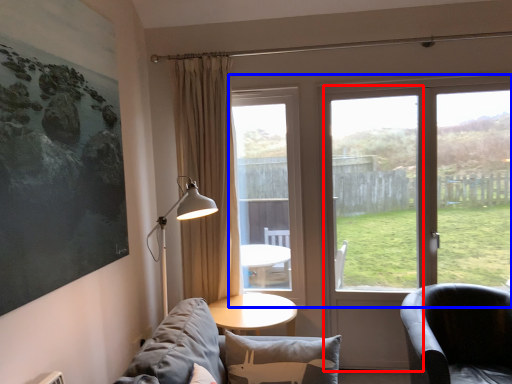
Question: Which object is further to the camera taking this photo, screen door (highlighted by a red box) or window (highlighted by a blue box)?

Choices:
 (A) screen door
 (B) window

Answer: (A)